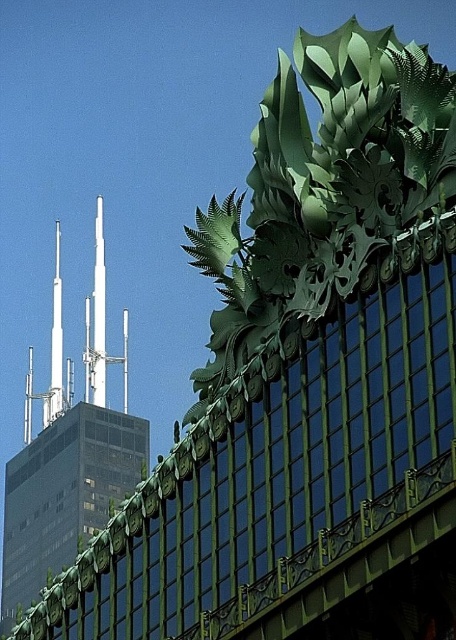
Question: Can you confirm if white metallic spire at upper center is positioned to the right of white glossy spire at upper left?

Choices:
 (A) yes
 (B) no

Answer: (A)

Question: Observing the image, what is the correct spatial positioning of white metallic spire at upper center in reference to white glossy spire at upper left?

Choices:
 (A) above
 (B) below

Answer: (A)

Question: Which point is closer to the camera?

Choices:
 (A) (57, 355)
 (B) (93, 314)

Answer: (A)

Question: Can you confirm if white metallic spire at upper center is positioned below white glossy spire at upper left?

Choices:
 (A) yes
 (B) no

Answer: (B)

Question: Which point appears farthest from the camera in this image?

Choices:
 (A) pos(29,426)
 (B) pos(55,333)

Answer: (A)